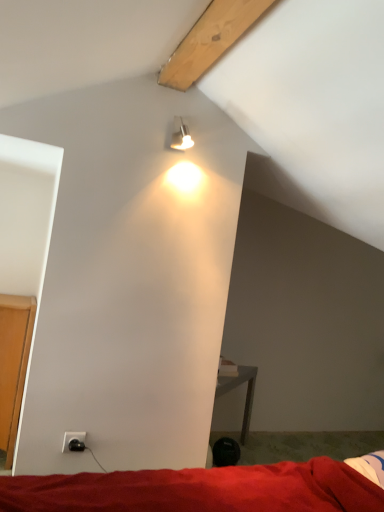
This screenshot has width=384, height=512. What do you see at coordinates (200, 489) in the screenshot?
I see `red fabric bed at lower center` at bounding box center [200, 489].

In order to click on black plastic power outlet at lower left in this screenshot , I will do `click(74, 441)`.

Where is `metallic silver spotlight at upper center`? The height and width of the screenshot is (512, 384). metallic silver spotlight at upper center is located at coordinates (181, 138).

Is black plastic power outlet at lower left spatially inside metallic silver spotlight at upper center, or outside of it?

black plastic power outlet at lower left is outside metallic silver spotlight at upper center.

Image resolution: width=384 pixels, height=512 pixels. What are the coordinates of `lamp above the black plastic power outlet at lower left (from a real-world perspective)` in the screenshot? It's located at (181, 138).

Does black plastic power outlet at lower left come behind metallic silver spotlight at upper center?

No, black plastic power outlet at lower left is in front of metallic silver spotlight at upper center.

Is black plastic power outlet at lower left not close to metallic silver spotlight at upper center?

That's right, there is a large distance between black plastic power outlet at lower left and metallic silver spotlight at upper center.

From a real-world perspective, which object rests below the other?

red fabric bed at lower center is physically lower.

Is red fabric bed at lower center looking in the opposite direction of metallic silver spotlight at upper center?

No, red fabric bed at lower center is not facing the opposite direction of metallic silver spotlight at upper center.

Considering the sizes of objects red fabric bed at lower center and black plastic power outlet at lower left in the image provided, who is smaller, red fabric bed at lower center or black plastic power outlet at lower left?

black plastic power outlet at lower left is smaller.

Consider the image. Considering the sizes of red fabric bed at lower center and black plastic power outlet at lower left in the image, is red fabric bed at lower center taller or shorter than black plastic power outlet at lower left?

red fabric bed at lower center is taller than black plastic power outlet at lower left.

Is red fabric bed at lower center facing towards black plastic power outlet at lower left?

No, red fabric bed at lower center does not turn towards black plastic power outlet at lower left.

Consider the image. Choose the correct answer: Is red fabric bed at lower center inside black plastic power outlet at lower left or outside it?

red fabric bed at lower center is not inside black plastic power outlet at lower left, it's outside.

Is metallic silver spotlight at upper center to the left of black plastic power outlet at lower left from the viewer's perspective?

No.

Is metallic silver spotlight at upper center not near black plastic power outlet at lower left?

metallic silver spotlight at upper center is positioned a significant distance from black plastic power outlet at lower left.

In the scene shown: Is metallic silver spotlight at upper center looking in the opposite direction of black plastic power outlet at lower left?

No, black plastic power outlet at lower left is not at the back of metallic silver spotlight at upper center.

From the image's perspective, relative to black plastic power outlet at lower left, is metallic silver spotlight at upper center above or below?

metallic silver spotlight at upper center is above black plastic power outlet at lower left.

Is metallic silver spotlight at upper center behind red fabric bed at lower center?

Yes, it is behind red fabric bed at lower center.

From the image's perspective, which is below, metallic silver spotlight at upper center or red fabric bed at lower center?

red fabric bed at lower center, from the image's perspective.

Would you consider metallic silver spotlight at upper center to be distant from red fabric bed at lower center?

metallic silver spotlight at upper center is positioned a significant distance from red fabric bed at lower center.

How many degrees apart are the facing directions of metallic silver spotlight at upper center and red fabric bed at lower center?

metallic silver spotlight at upper center and red fabric bed at lower center are facing 103 degrees away from each other.

Based on the photo, is black plastic power outlet at lower left thinner than red fabric bed at lower center?

Indeed, black plastic power outlet at lower left has a lesser width compared to red fabric bed at lower center.

Based on the photo, from the image's perspective, is black plastic power outlet at lower left above or below red fabric bed at lower center?

Based on their image positions, black plastic power outlet at lower left is located above red fabric bed at lower center.

Considering the positions of points (76, 448) and (313, 490), is point (76, 448) farther from camera compared to point (313, 490)?

Yes.

Image resolution: width=384 pixels, height=512 pixels. Identify the location of lamp behind the black plastic power outlet at lower left. (181, 138).

Find the location of `bed below the metallic silver spotlight at upper center (from the image's perspective)`. bed below the metallic silver spotlight at upper center (from the image's perspective) is located at coordinates (200, 489).

When comparing their distances from red fabric bed at lower center, does black plastic power outlet at lower left or metallic silver spotlight at upper center seem further?

Among the two, metallic silver spotlight at upper center is located further to red fabric bed at lower center.

Looking at the image, which one is located closer to red fabric bed at lower center, metallic silver spotlight at upper center or black plastic power outlet at lower left?

The object closer to red fabric bed at lower center is black plastic power outlet at lower left.

Consider the image. From the image, which object appears to be nearer to black plastic power outlet at lower left, metallic silver spotlight at upper center or red fabric bed at lower center?

Based on the image, red fabric bed at lower center appears to be nearer to black plastic power outlet at lower left.

Based on their spatial positions, is black plastic power outlet at lower left or red fabric bed at lower center further from metallic silver spotlight at upper center?

red fabric bed at lower center.

Considering their positions, is red fabric bed at lower center positioned closer to black plastic power outlet at lower left than metallic silver spotlight at upper center?

red fabric bed at lower center lies closer to black plastic power outlet at lower left than the other object.

From the image, which object appears to be farther from metallic silver spotlight at upper center, red fabric bed at lower center or black plastic power outlet at lower left?

Based on the image, red fabric bed at lower center appears to be further to metallic silver spotlight at upper center.

Where is `power outlet between metallic silver spotlight at upper center and red fabric bed at lower center in the vertical direction`? The image size is (384, 512). power outlet between metallic silver spotlight at upper center and red fabric bed at lower center in the vertical direction is located at coordinates (74, 441).